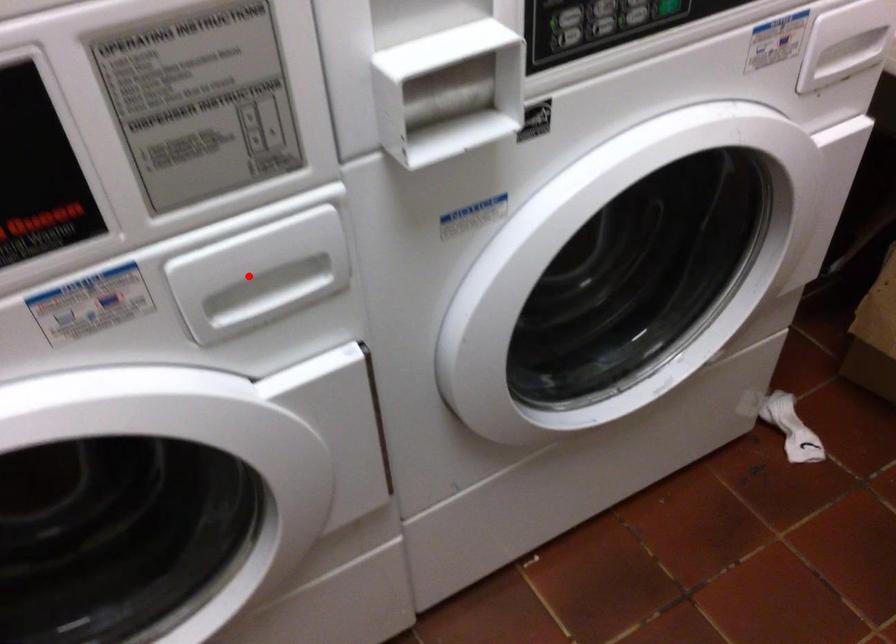
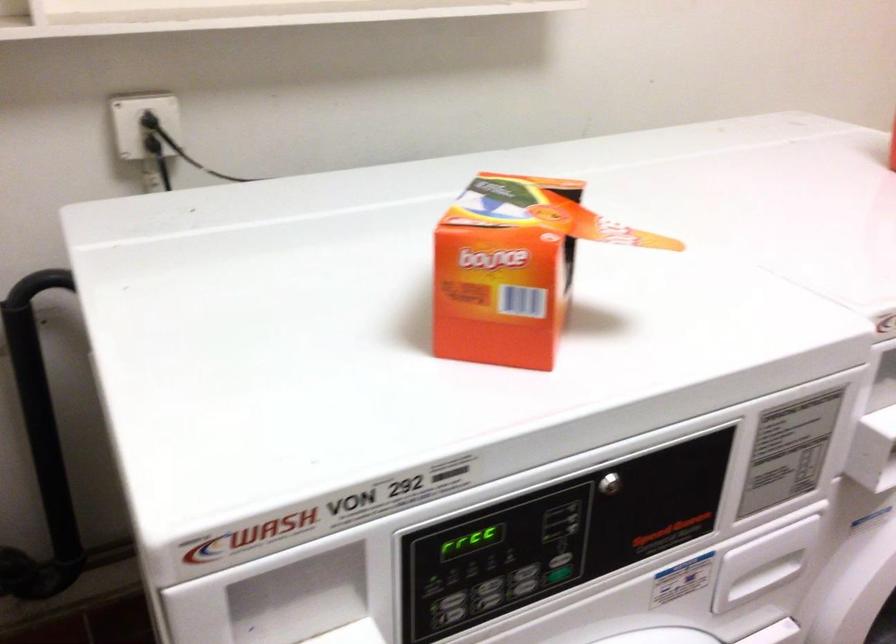
Question: I am providing you with two images of the same scene from different viewpoints. In image1, a red point is highlighted. Considering the same 3D point in image2, which of the following is correct?

Choices:
 (A) It is closer
 (B) It is farther

Answer: (B)